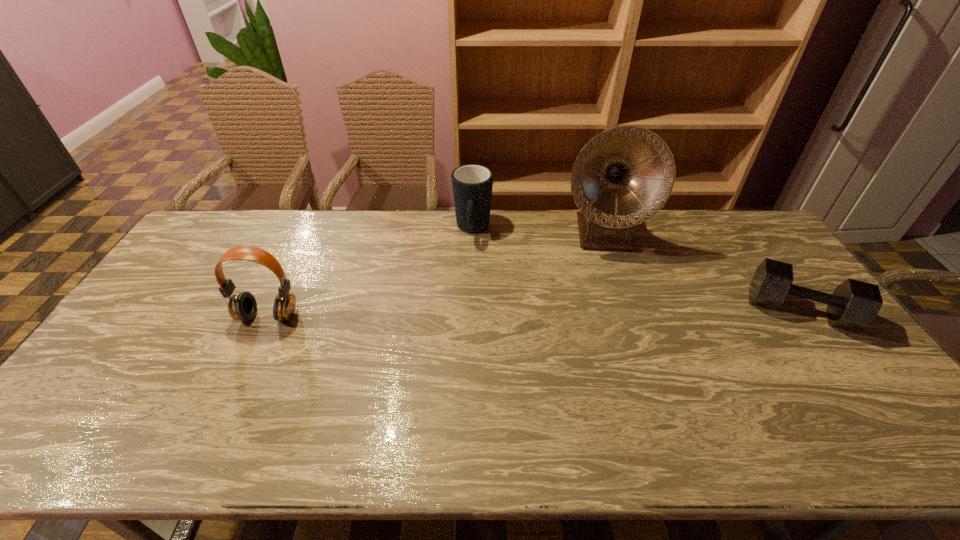
Locate an element on the screen. The image size is (960, 540). free space on the desktop that is between the headset and the shortest object and is positioned on the side of the mug with the handle is located at coordinates (464, 314).

Find the location of a particular element. The image size is (960, 540). free spot on the desktop that is between the headset and the rightmost object and is positioned on the horn of the phonograph record is located at coordinates (614, 312).